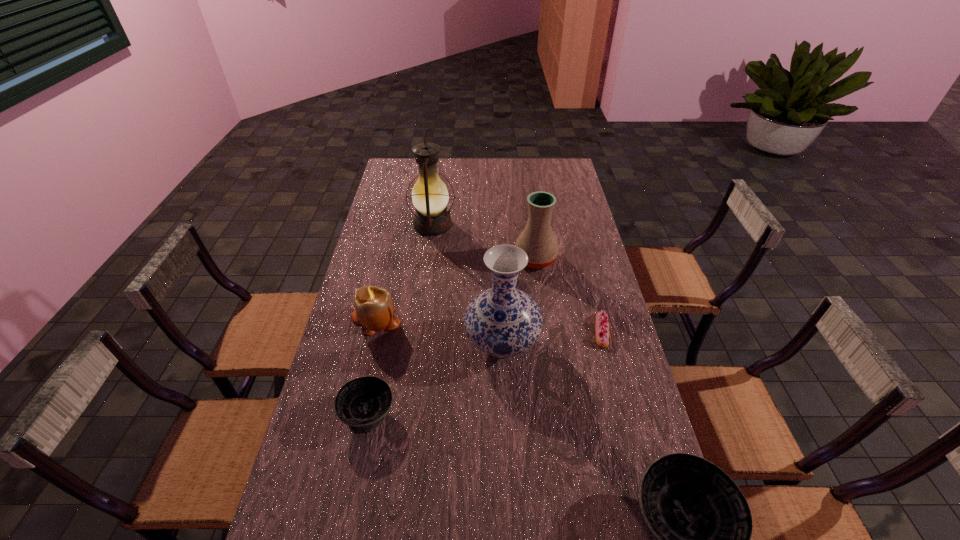
Please point a space for a new bowl to maintain equal intervals. Please provide its 2D coordinates. Your answer should be formatted as a tuple, i.e. [(x, y)], where the tuple contains the x and y coordinates of a point satisfying the conditions above.

[(510, 463)]